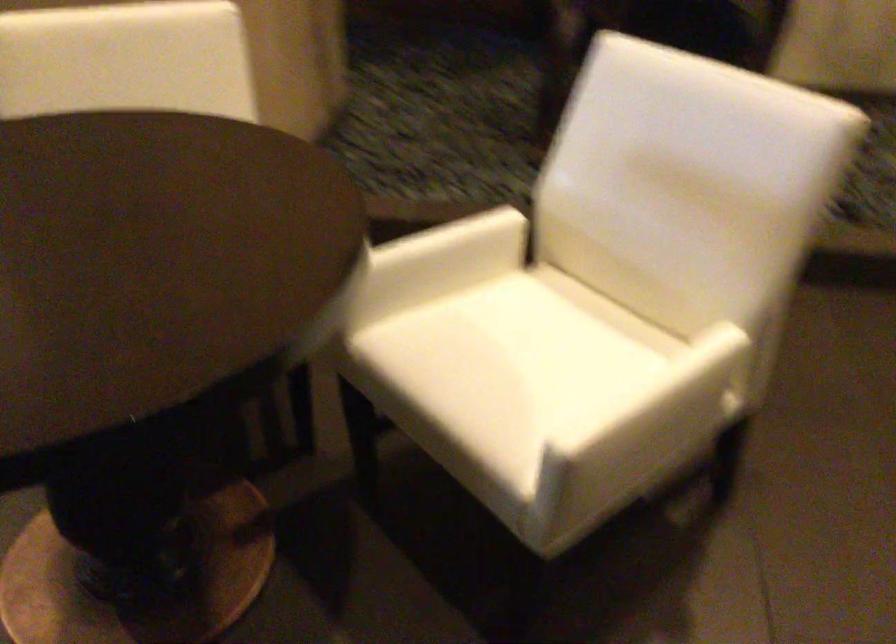
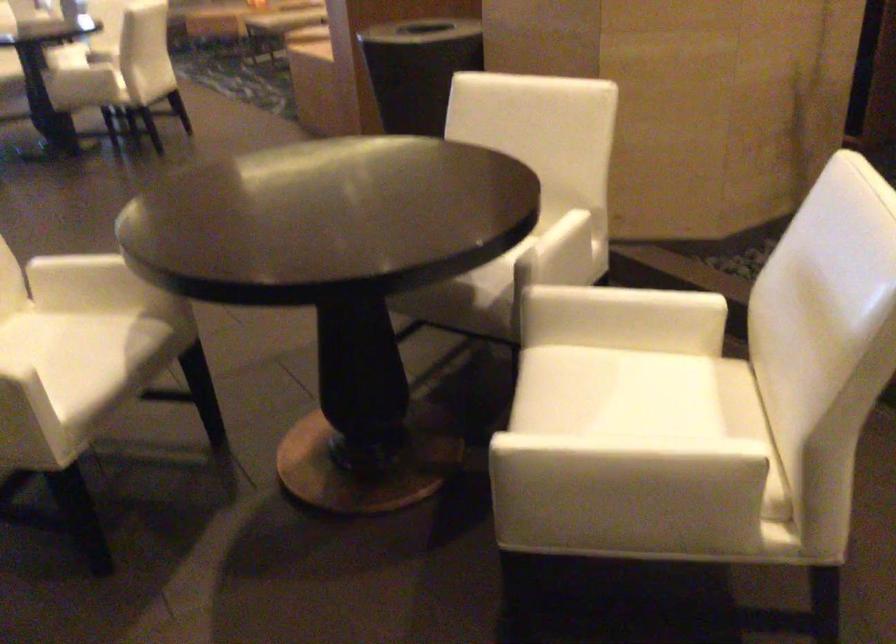
Find the pixel in the second image that matches the point at 659,408 in the first image.

(607, 462)